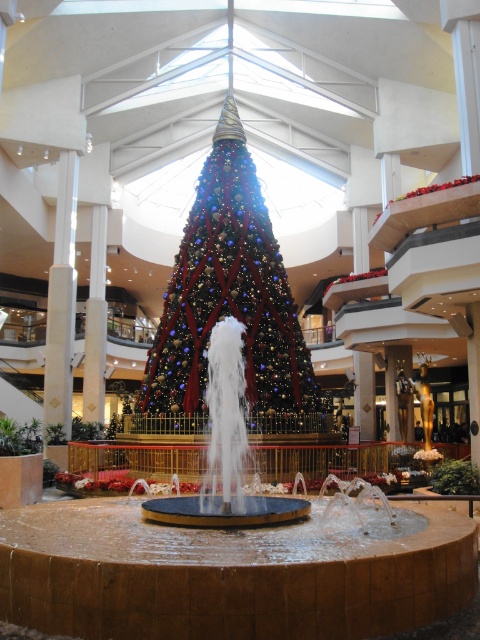
You are standing in the shopping mall atrium and want to take a photo of the multicolored glittering tree at center. If you are currently at position coordinates of point 0.475, 0.477, which is the exact location of the tree, where should you move to get a clear view?

You are currently at the exact location of the multicolored glittering tree at center, so you need to move away from point (228,304) to get a clear view.

You are a photographer planning to capture the multicolored glittering tree at center and the shiny metallic fountain at center in a single wide shot. Based on their sizes, which object will occupy more space in the photo?

The multicolored glittering tree at center will occupy more space in the photo because its width surpasses that of the shiny metallic fountain at center, as stated in the description.

You are a visitor at the mall and want to take a photo of both the multicolored glittering tree at center and the shiny metallic fountain at center. Since you are standing at the entrance, which object should you move towards first to capture both in your frame?

The multicolored glittering tree at center is positioned on the left side of the shiny metallic fountain at center. To capture both in your frame, you should move towards the shiny metallic fountain at center first, as it is closer to your current position at the entrance and allows you to adjust your angle to include the tree on its left side.